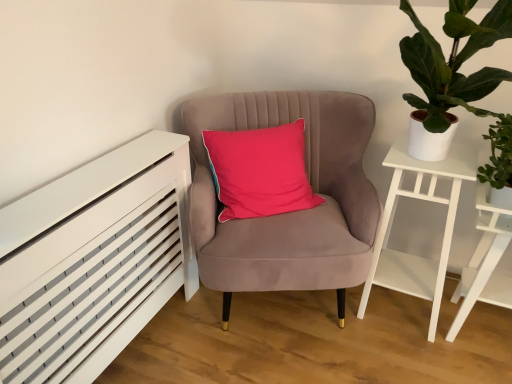
Find the location of a particular element. This screenshot has width=512, height=384. free area below velvet pink chair at center (from a real-world perspective) is located at coordinates (272, 312).